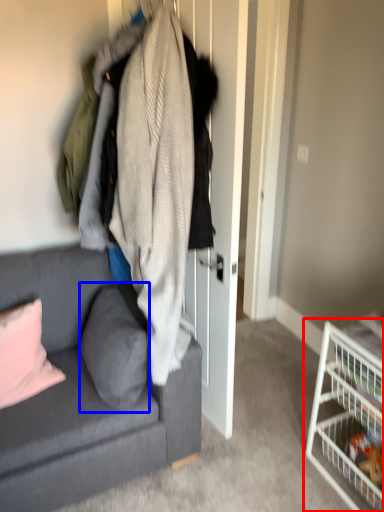
Question: Among these objects, which one is farthest to the camera, shelf (highlighted by a red box) or pillow (highlighted by a blue box)?

Choices:
 (A) shelf
 (B) pillow

Answer: (B)